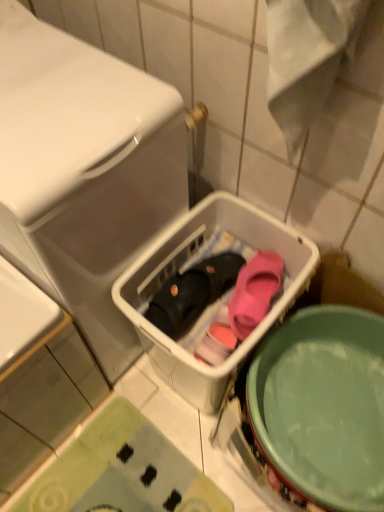
Question: Is green textured bath mat at lower left to the right of pink matte slipper at center, the second footwear from the left, from the viewer's perspective?

Choices:
 (A) yes
 (B) no

Answer: (B)

Question: From the image's perspective, does green textured bath mat at lower left appear higher than pink matte slipper at center, which ranks as the first footwear in right-to-left order?

Choices:
 (A) yes
 (B) no

Answer: (B)

Question: Does green textured bath mat at lower left have a greater height compared to pink matte slipper at center, the second footwear from the left?

Choices:
 (A) yes
 (B) no

Answer: (B)

Question: Can you see green textured bath mat at lower left touching pink matte slipper at center, the second footwear from the left?

Choices:
 (A) no
 (B) yes

Answer: (A)

Question: Considering the relative sizes of green textured bath mat at lower left and pink matte slipper at center, the second footwear from the left, in the image provided, is green textured bath mat at lower left wider than pink matte slipper at center, the second footwear from the left,?

Choices:
 (A) yes
 (B) no

Answer: (A)

Question: Does green textured bath mat at lower left have a lesser height compared to pink matte slipper at center, the second footwear from the left?

Choices:
 (A) no
 (B) yes

Answer: (B)

Question: Does white plastic basket at center, which ranks as the second dish washer in left-to-right order, have a lesser width compared to green textured bath mat at lower left?

Choices:
 (A) yes
 (B) no

Answer: (A)

Question: Is white plastic basket at center, the 1th dish washer when ordered from right to left, at the right side of green textured bath mat at lower left?

Choices:
 (A) no
 (B) yes

Answer: (B)

Question: Are white plastic basket at center, which ranks as the second dish washer in left-to-right order, and green textured bath mat at lower left making contact?

Choices:
 (A) yes
 (B) no

Answer: (B)

Question: Is white plastic basket at center, which ranks as the second dish washer in left-to-right order, closer to camera compared to green textured bath mat at lower left?

Choices:
 (A) yes
 (B) no

Answer: (A)

Question: Is green textured bath mat at lower left inside white plastic basket at center, which ranks as the second dish washer in left-to-right order?

Choices:
 (A) yes
 (B) no

Answer: (B)

Question: Is white plastic basket at center, the 1th dish washer when ordered from right to left, oriented away from green textured bath mat at lower left?

Choices:
 (A) yes
 (B) no

Answer: (B)

Question: From a real-world perspective, is green matte mixing bowl at lower right located beneath green textured bath mat at lower left?

Choices:
 (A) no
 (B) yes

Answer: (A)